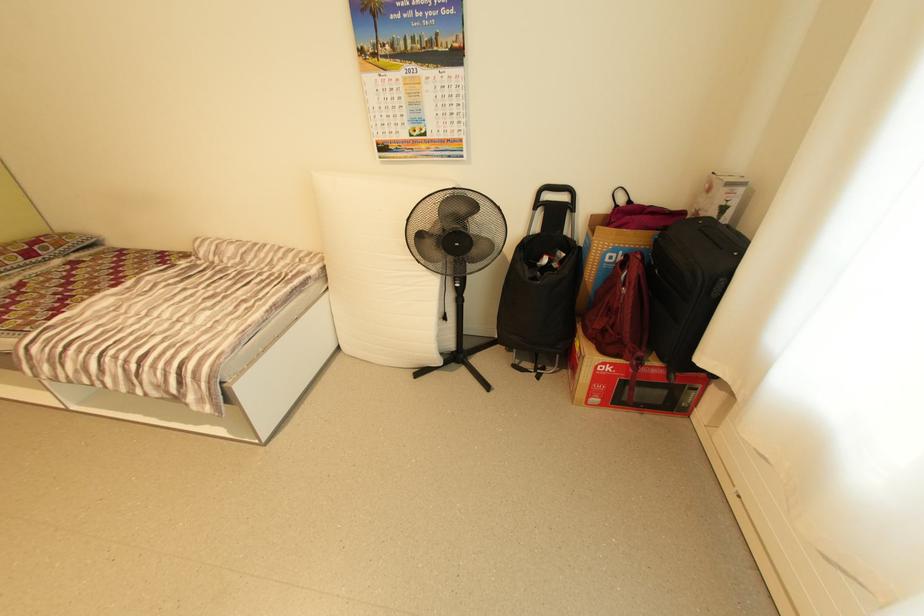
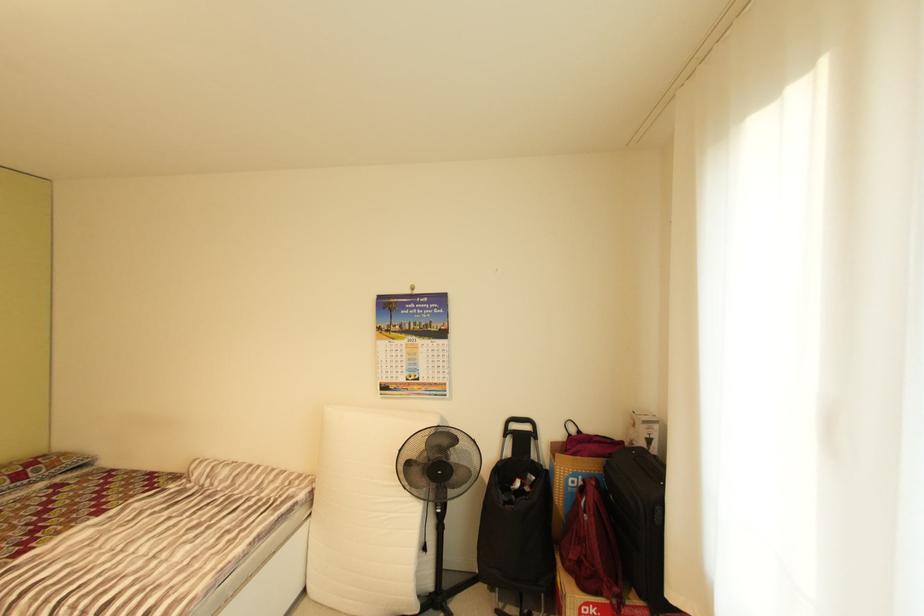
Question: The first image is from the beginning of the video and the second image is from the end. How did the camera likely rotate when shooting the video?

Choices:
 (A) Left
 (B) Right
 (C) Up
 (D) Down

Answer: (C)